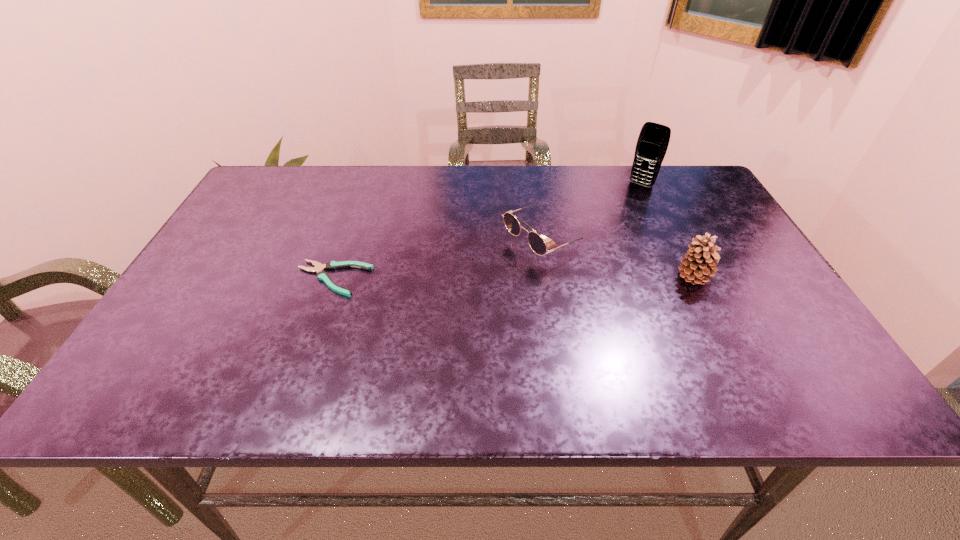
Image resolution: width=960 pixels, height=540 pixels. Identify the location of free region located 0.130m on the front lenses of the third tallest object. (468, 279).

The height and width of the screenshot is (540, 960). In order to click on free space located 0.220m on the front lenses of the third tallest object in this screenshot , I will do `click(434, 295)`.

Where is `vacant area situated 0.350m on the screen of the tallest object`? vacant area situated 0.350m on the screen of the tallest object is located at coordinates (583, 253).

Where is `vacant space located 0.220m on the screen of the tallest object`? The height and width of the screenshot is (540, 960). vacant space located 0.220m on the screen of the tallest object is located at coordinates (605, 227).

Where is `free spot located on the screen of the tallest object`? free spot located on the screen of the tallest object is located at coordinates (629, 198).

The width and height of the screenshot is (960, 540). Find the location of `object at the far edge`. object at the far edge is located at coordinates (653, 140).

At what (x,y) coordinates should I click in order to perform the action: click on pinecone situated at the right edge. Please return your answer as a coordinate pair (x, y). Looking at the image, I should click on (700, 260).

Where is `cellular telephone at the right edge`? The image size is (960, 540). cellular telephone at the right edge is located at coordinates (653, 140).

Identify the location of object that is at the far right corner. Image resolution: width=960 pixels, height=540 pixels. (653, 140).

You are a GUI agent. You are given a task and a screenshot of the screen. Output one action in this format:
    pyautogui.click(x=<x>, y=<y>)
    Task: Click on the free location at the far edge
    Image resolution: width=960 pixels, height=540 pixels.
    Given the screenshot: What is the action you would take?
    pyautogui.click(x=656, y=198)